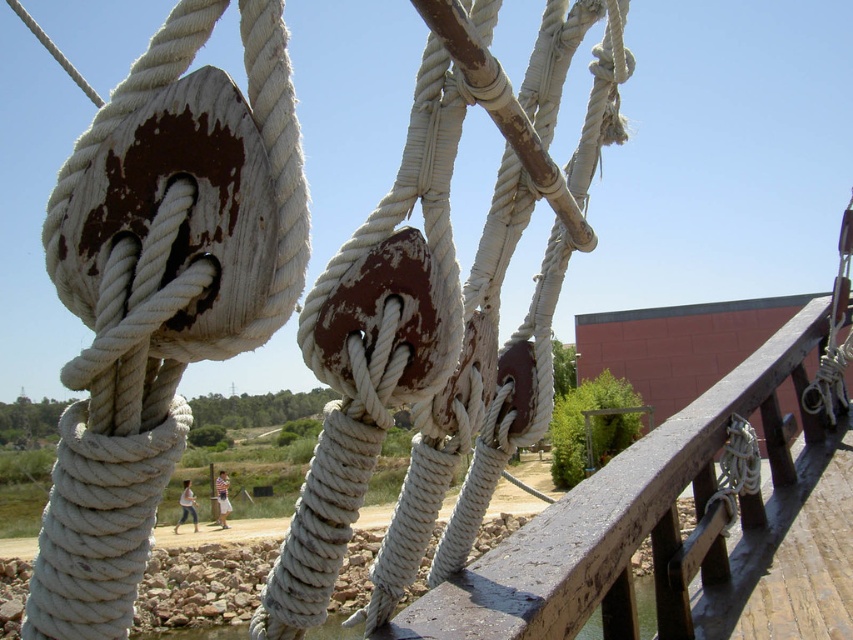
Question: Observing the image, what is the correct spatial positioning of rustic wood rail at center in reference to clear water at lower left?

Choices:
 (A) left
 (B) right

Answer: (B)

Question: Among these objects, which one is farthest from the camera?

Choices:
 (A) clear water at lower left
 (B) rustic wood rail at center

Answer: (B)

Question: Is rustic wood rail at center in front of clear water at lower left?

Choices:
 (A) no
 (B) yes

Answer: (A)

Question: Can you confirm if rustic wood rail at center is thinner than clear water at lower left?

Choices:
 (A) no
 (B) yes

Answer: (B)